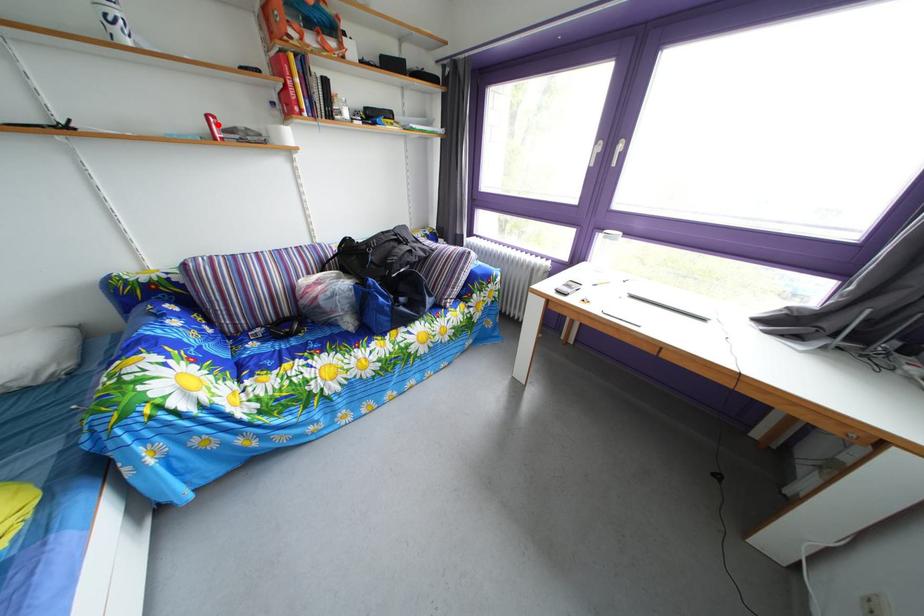
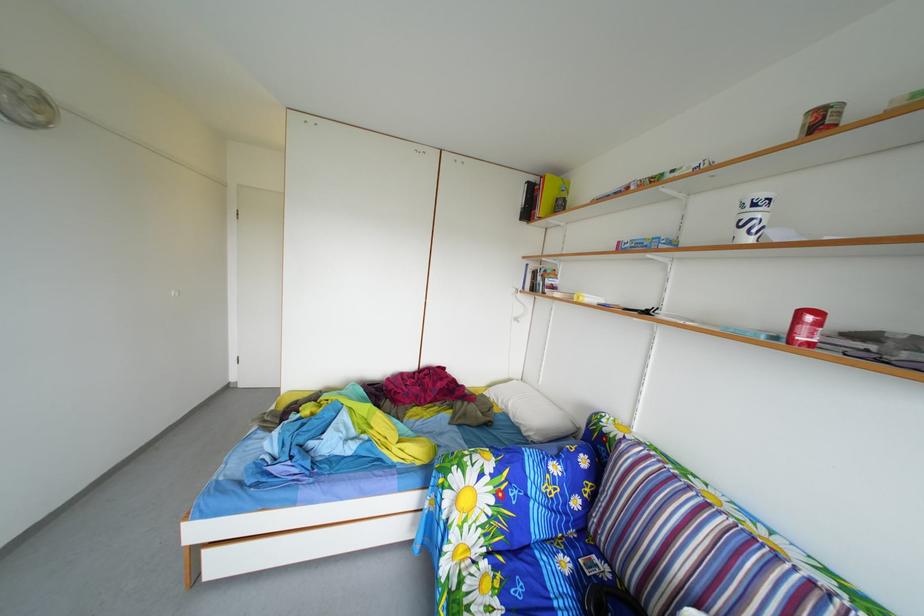
Where in the second image is the point corresponding to the highlighted location from the first image?

(811, 321)